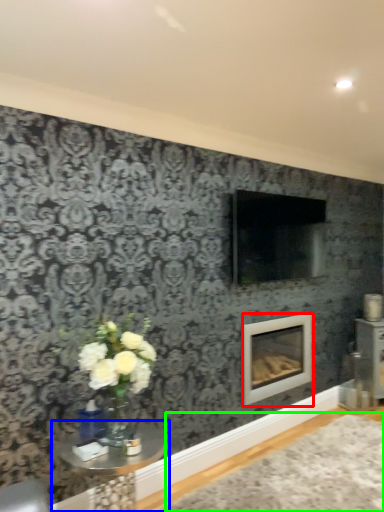
Question: Which is nearer to the fireplace (highlighted by a red box)? table (highlighted by a blue box) or plain (highlighted by a green box).

Choices:
 (A) table
 (B) plain

Answer: (B)